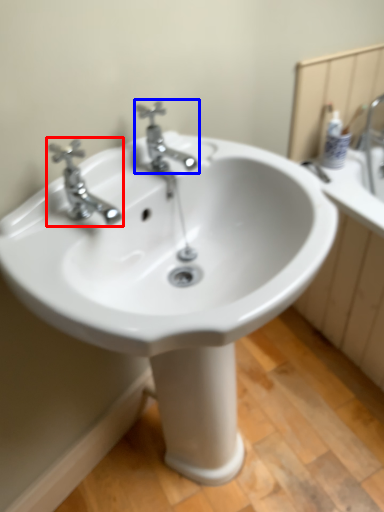
Question: Among these objects, which one is nearest to the camera, tap (highlighted by a red box) or tap (highlighted by a blue box)?

Choices:
 (A) tap
 (B) tap

Answer: (A)